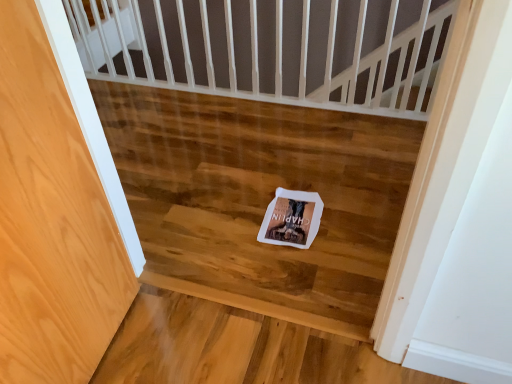
This screenshot has height=384, width=512. I want to click on free space above wooden floor at center (from a real-world perspective), so click(206, 168).